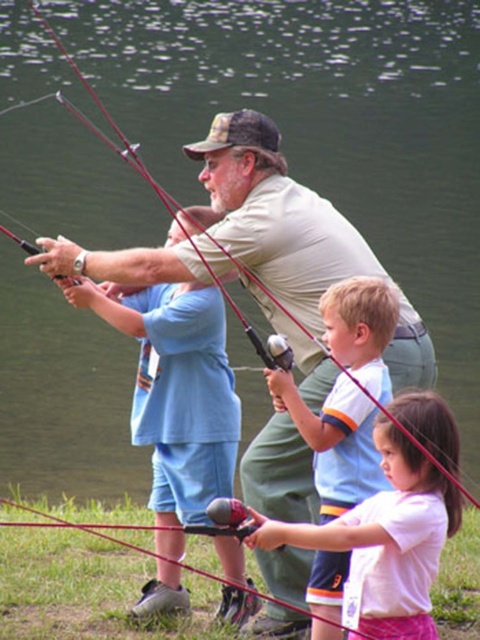
How much distance is there between white matte shirt at center and white cotton shirt at center?

white matte shirt at center is 27.81 inches from white cotton shirt at center.

Who is positioned more to the right, white matte shirt at center or white cotton shirt at center?

Positioned to the right is white matte shirt at center.

Which is behind, point (444, 428) or point (348, 561)?

The point (348, 561) is behind.

Where is `white matte shirt at center`? white matte shirt at center is located at coordinates (386, 540).

The width and height of the screenshot is (480, 640). What do you see at coordinates (176, 388) in the screenshot? I see `blue cotton shirt at center` at bounding box center [176, 388].

Can you confirm if blue cotton shirt at center is bigger than white matte shirt at center?

Correct, blue cotton shirt at center is larger in size than white matte shirt at center.

Between point (226, 428) and point (338, 548), which one is positioned in front?

Point (338, 548)

Locate an element on the screen. blue cotton shirt at center is located at coordinates (176, 388).

Is point (213, 339) farther from viewer compared to point (328, 404)?

Yes, it is behind point (328, 404).

Consider the image. Is blue cotton shirt at center below white cotton shirt at center?

Yes, blue cotton shirt at center is below white cotton shirt at center.

The width and height of the screenshot is (480, 640). In order to click on blue cotton shirt at center in this screenshot , I will do `click(176, 388)`.